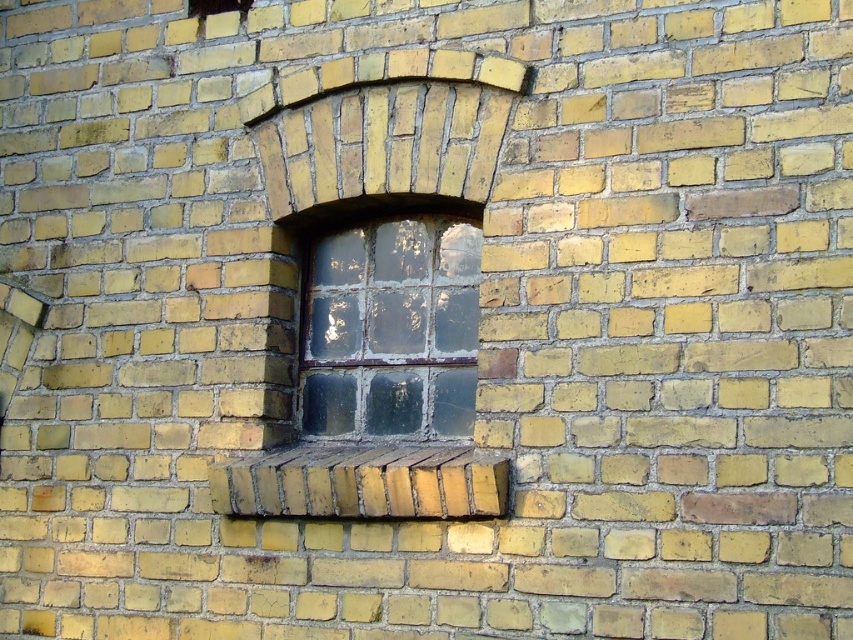
You are an architect designing a new building and want to ensure the window and brick dimensions align with the original structure. Given the clear glass window at center and the yellow brick at center, which one has a smaller width?

The clear glass window at center has a lesser width compared to the yellow brick at center, so the window is narrower.

You are standing directly in front of the brick wall. Where is the clear glass window at center located in relation to your viewpoint?

The clear glass window at center is located at the central area of the brick wall, positioned at coordinates approximately 0.516 along the horizontal axis and 0.460 along the vertical axis from the bottom left corner of the image.